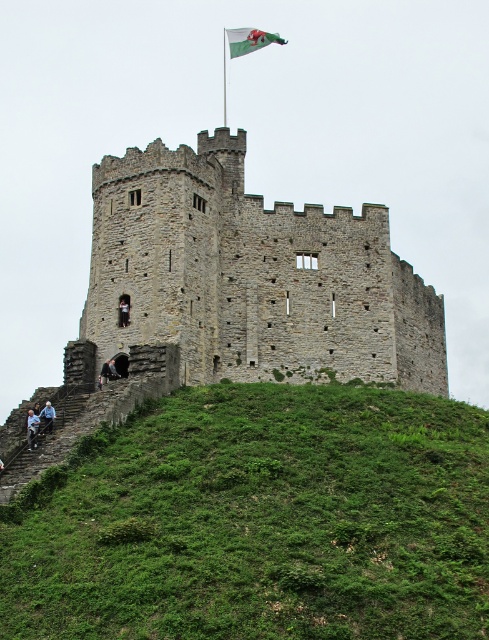
You are a visitor standing at the base of the castle hill. You see the green fabric flag at upper center and the dark gray stone person at center. Which object is closer to you?

The green fabric flag at upper center is closer to you because the dark gray stone person at center is behind it.

You are standing at the base of the castle and notice two features in the lower left area. One is the green grassy hillside at lower left and the other is the dark gray stone person at lower left. Which one is positioned to the right when viewed from your perspective?

The green grassy hillside at lower left is to the right of the dark gray stone person at lower left.